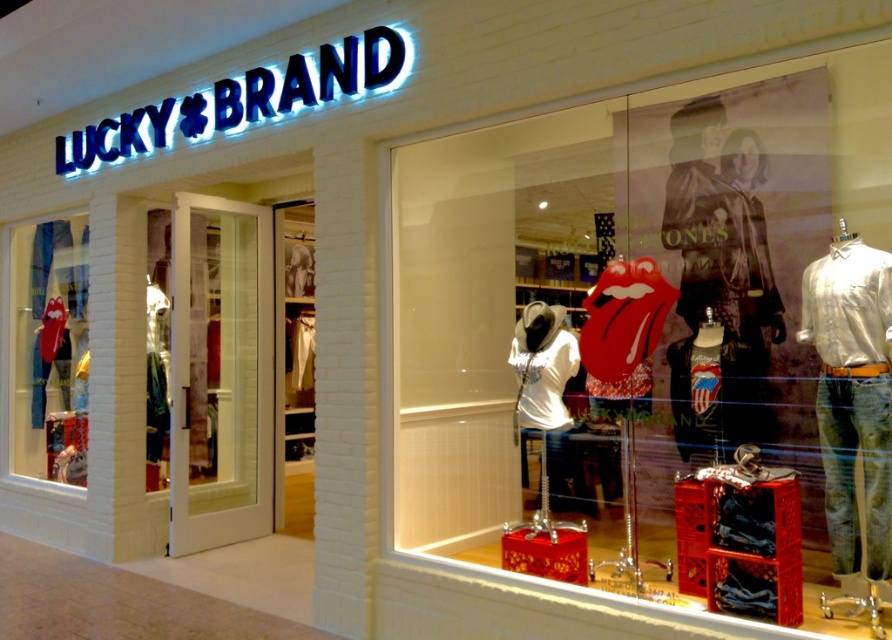
You are a customer standing outside the Lucky Brand store looking through the window. You see the matte red crate at center and the matte red lips at left. Which object is positioned to the left side of the other?

The matte red lips at left are positioned to the left of the matte red crate at center.

You are a customer standing outside the Lucky Brand store looking through the glass window. You see the matte red crate at center and the matte red lips at left. Which object is positioned higher in the window display?

The matte red crate at center is positioned higher than the matte red lips at left in the window display.